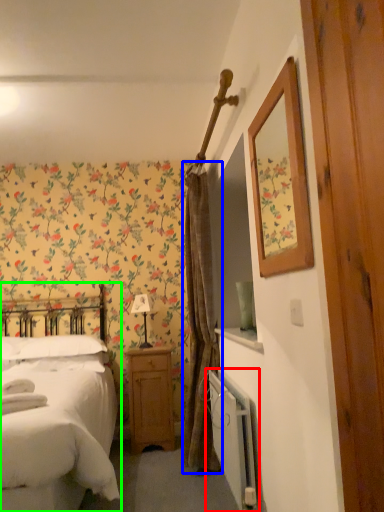
Question: Based on their relative distances, which object is nearer to radiator (highlighted by a red box)? Choose from curtain (highlighted by a blue box) and bed (highlighted by a green box).

Choices:
 (A) curtain
 (B) bed

Answer: (A)